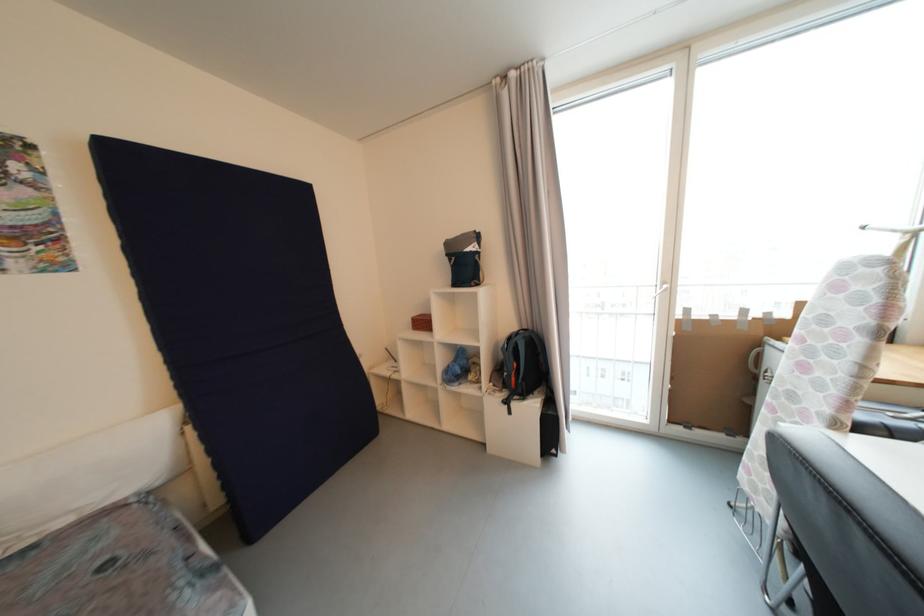
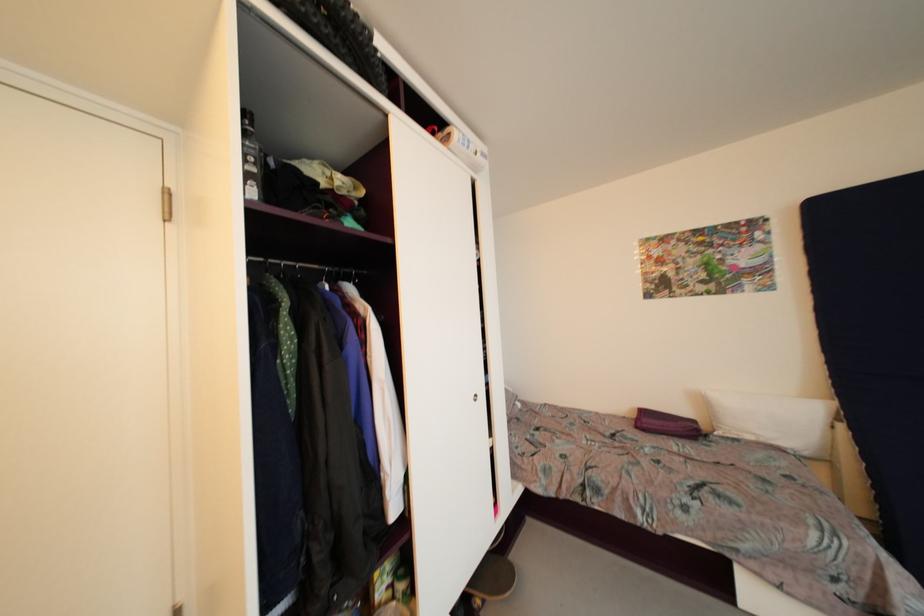
Question: The first image is from the beginning of the video and the second image is from the end. How did the camera likely rotate when shooting the video?

Choices:
 (A) Left
 (B) Right
 (C) Up
 (D) Down

Answer: (A)